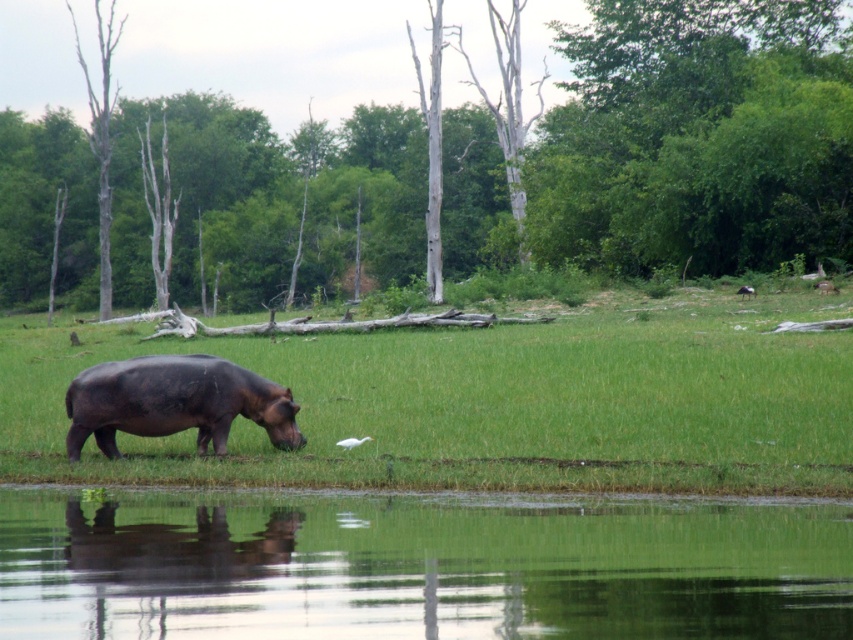
You are a photographer trying to capture the dark brown matte hippo at center and the brown bark tree at center in the same frame. Based on their positions, which object is closer to you?

The brown bark tree at center is closer to you because the dark brown matte hippo at center is positioned behind it.

You are standing at the point marked by the coordinates point (463, 166). Which object is directly in front of you?

The point (463, 166) marks the brown bark tree at center, so the brown bark tree at center is directly in front of you.